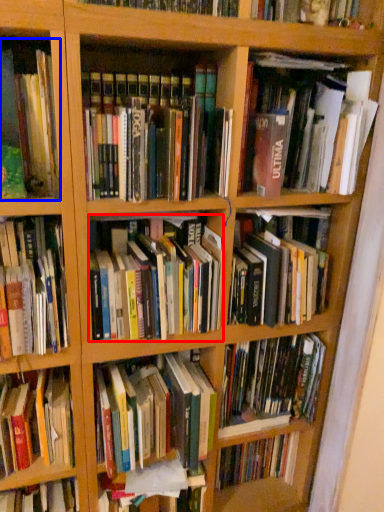
Question: Which object appears closest to the camera in this image, book (highlighted by a red box) or book (highlighted by a blue box)?

Choices:
 (A) book
 (B) book

Answer: (B)